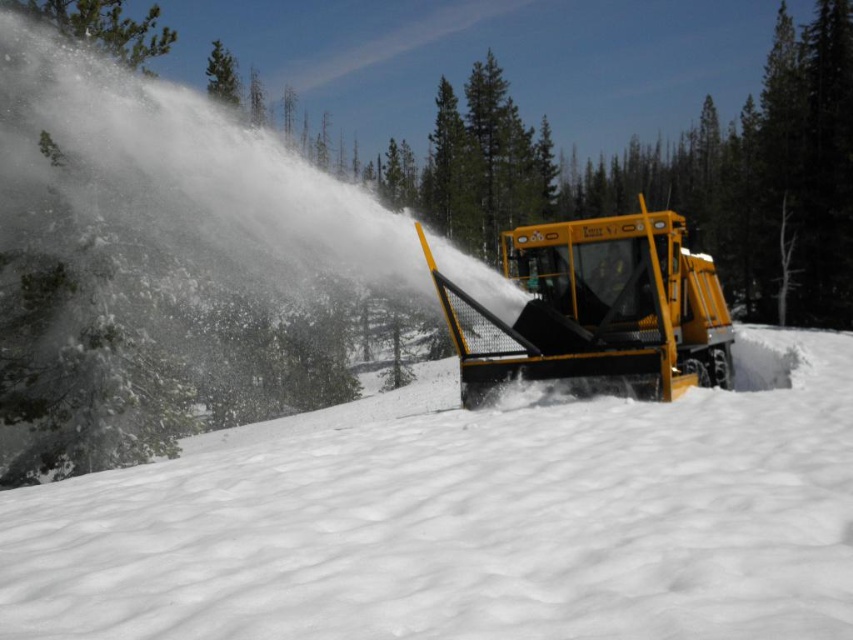
Measure the distance between point [675,476] and camera.

Point [675,476] and camera are 4.08 meters apart from each other.

Between point (303, 554) and point (585, 248), which one is positioned behind?

Positioned behind is point (585, 248).

In order to click on white powdery snow at center in this screenshot , I will do [468, 518].